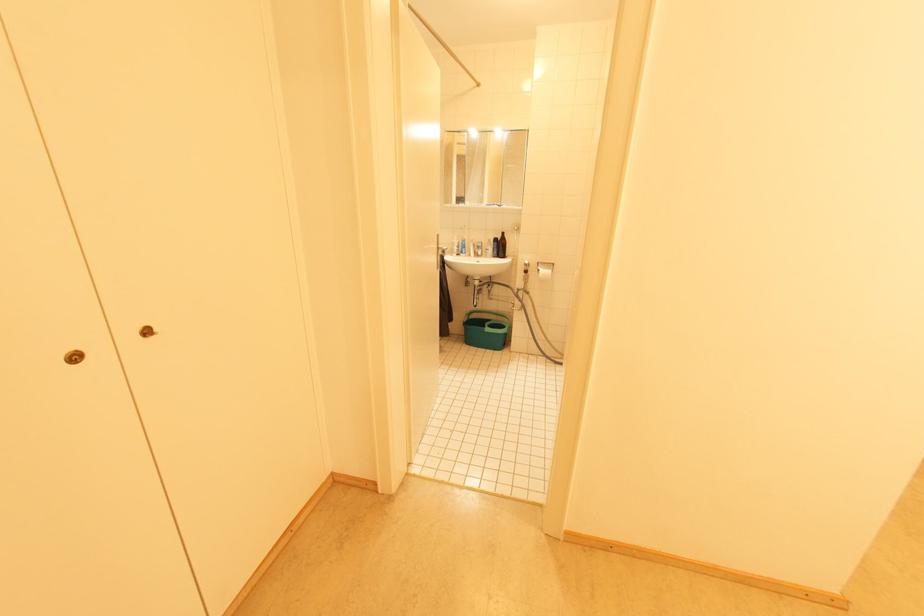
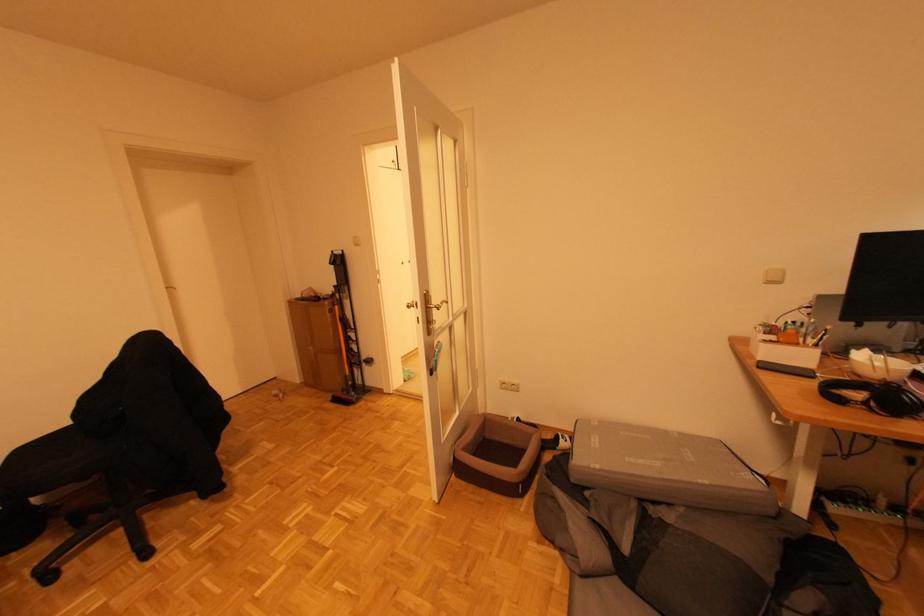
Question: What movement of the cameraman would produce the second image?

Choices:
 (A) Left
 (B) Right
 (C) Forward
 (D) Backward

Answer: (D)